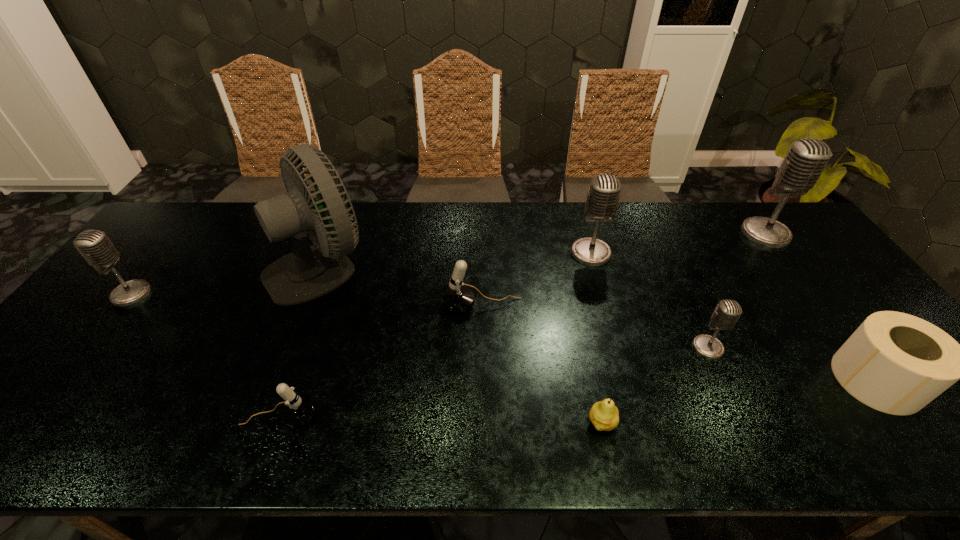
You are a GUI agent. You are given a task and a screenshot of the screen. Output one action in this format:
    pyautogui.click(x=<x>, y=<y>)
    Task: Click on the vacant space located 0.270m on the right of the seventh object from left to right
    This screenshot has width=960, height=540.
    Given the screenshot: What is the action you would take?
    pyautogui.click(x=829, y=348)

The height and width of the screenshot is (540, 960). What are the coordinates of `free space located 0.190m on the left of the toilet tissue` in the screenshot? It's located at (756, 380).

Where is `blank area located on the left of the left white microphone`? Image resolution: width=960 pixels, height=540 pixels. blank area located on the left of the left white microphone is located at coordinates (61, 416).

This screenshot has height=540, width=960. Identify the location of blank space located 0.110m on the left of the shortest object. (537, 423).

I want to click on fan at the far edge, so click(x=308, y=272).

You are a GUI agent. You are given a task and a screenshot of the screen. Output one action in this format:
    pyautogui.click(x=<x>, y=<y>)
    Task: Click on the microphone present at the near edge
    This screenshot has width=960, height=540.
    Given the screenshot: What is the action you would take?
    pyautogui.click(x=298, y=410)

The width and height of the screenshot is (960, 540). Find the location of `pear that is at the near edge`. pear that is at the near edge is located at coordinates (604, 415).

I want to click on object that is at the left edge, so click(x=94, y=245).

At what (x,y) coordinates should I click in order to perform the action: click on microphone that is at the right edge. Please return your answer as a coordinate pair (x, y). The height and width of the screenshot is (540, 960). Looking at the image, I should click on (806, 159).

Identify the location of toilet tissue situated at the right edge. Image resolution: width=960 pixels, height=540 pixels. (896, 363).